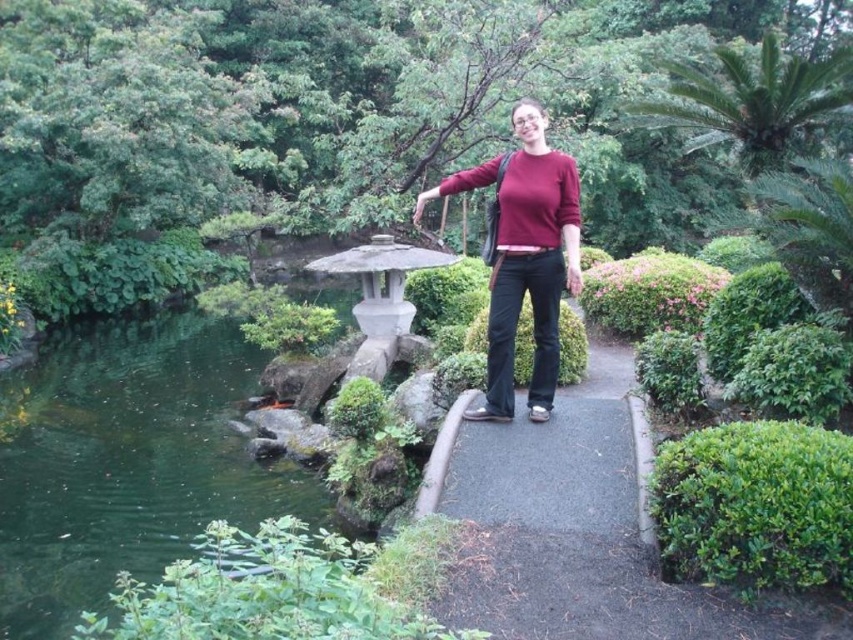
Question: Does green liquid water at lower left have a lesser width compared to matte red sweater at center?

Choices:
 (A) no
 (B) yes

Answer: (A)

Question: Which point is farther to the camera?

Choices:
 (A) (194, 355)
 (B) (515, 205)

Answer: (A)

Question: Which object appears closest to the camera in this image?

Choices:
 (A) green liquid water at lower left
 (B) matte red sweater at center

Answer: (A)

Question: Is green liquid water at lower left thinner than matte red sweater at center?

Choices:
 (A) no
 (B) yes

Answer: (A)

Question: Does green liquid water at lower left have a smaller size compared to matte red sweater at center?

Choices:
 (A) yes
 (B) no

Answer: (B)